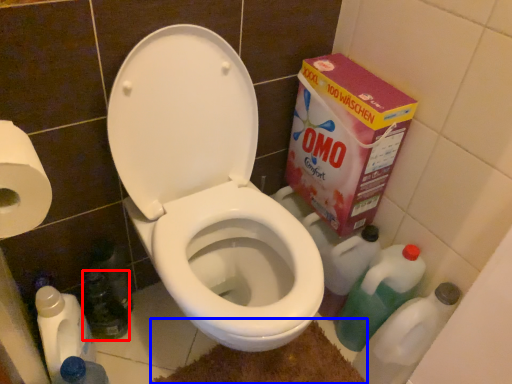
Question: Among these objects, which one is farthest to the camera, bottle (highlighted by a red box) or bath mat (highlighted by a blue box)?

Choices:
 (A) bottle
 (B) bath mat

Answer: (A)